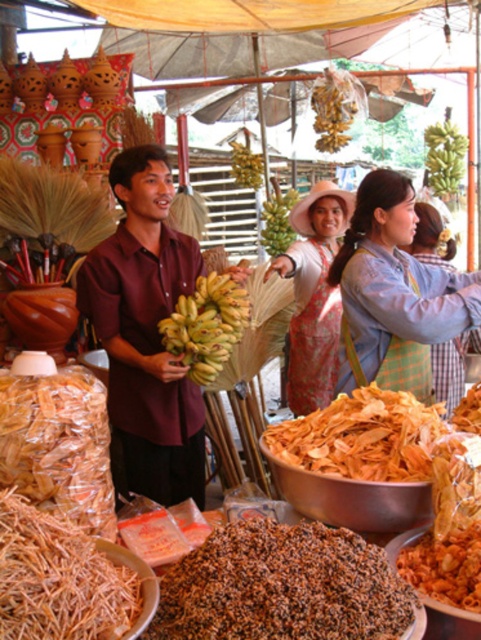
Question: Is green matte bananas at upper right behind yellow matte bananas at center?

Choices:
 (A) no
 (B) yes

Answer: (A)

Question: Which point appears farthest from the camera in this image?

Choices:
 (A) (287, 224)
 (B) (451, 157)
 (C) (433, 275)

Answer: (A)

Question: Which point is closer to the camera?

Choices:
 (A) yellow matte bananas at center
 (B) green matte bananas at upper right
 (C) blue cotton shirt at center
 (D) green matte bananas at center

Answer: (C)

Question: Can you confirm if brown crunchy insects at center is positioned below green matte bananas at upper right?

Choices:
 (A) no
 (B) yes

Answer: (B)

Question: Is green matte bananas at upper right bigger than green matte bananas at center?

Choices:
 (A) no
 (B) yes

Answer: (A)

Question: Which point is closer to the camera?

Choices:
 (A) (418, 257)
 (B) (368, 314)
 (C) (129, 170)
 (D) (182, 358)

Answer: (B)